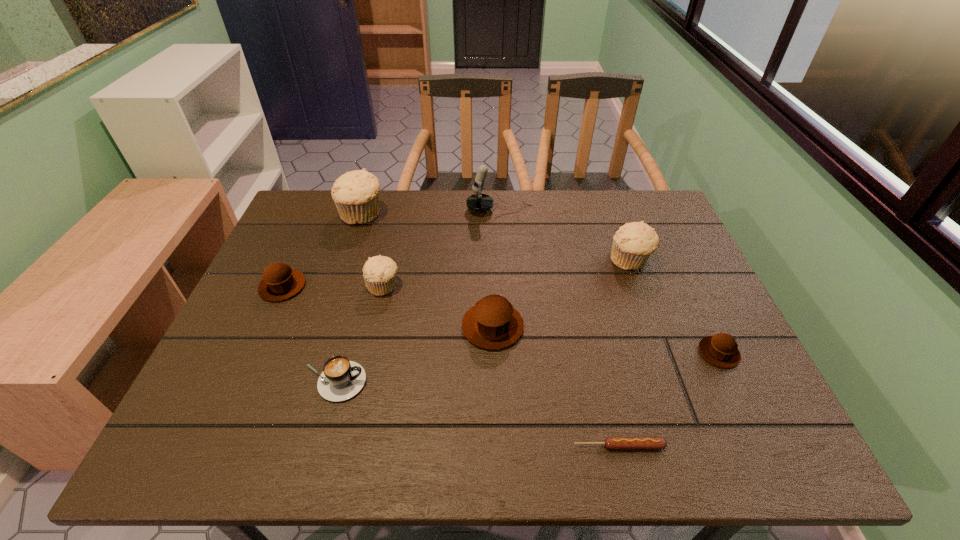
Identify the location of unoccupied area between the leftmost brown muffin and the microphone. The height and width of the screenshot is (540, 960). (391, 248).

At what (x,y) coordinates should I click in order to perform the action: click on vacant area that lies between the fifth tallest muffin and the cappuccino. Please return your answer as a coordinate pair (x, y). The height and width of the screenshot is (540, 960). Looking at the image, I should click on (308, 334).

You are a GUI agent. You are given a task and a screenshot of the screen. Output one action in this format:
    pyautogui.click(x=<x>, y=<y>)
    Task: Click on the free area in between the brown sausage and the seventh shortest object
    
    Given the screenshot: What is the action you would take?
    pyautogui.click(x=624, y=353)

Locate an element on the screen. The image size is (960, 540). empty location between the seventh object from left to right and the second beige muffin from right to left is located at coordinates (501, 366).

Locate which object ranks third in proximity to the microphone. Please provide its 2D coordinates. Your answer should be formatted as a tuple, i.e. [(x, y)], where the tuple contains the x and y coordinates of a point satisfying the conditions above.

[(379, 272)]

Find the location of `object that is the fourth closest to the farthest beige muffin`. object that is the fourth closest to the farthest beige muffin is located at coordinates (493, 323).

This screenshot has width=960, height=540. Find the location of `muffin that is the fourth closest to the brown sausage`. muffin that is the fourth closest to the brown sausage is located at coordinates (379, 272).

What are the coordinates of `the fifth closest muffin to the black cappuccino` in the screenshot? It's located at (633, 243).

Identify which beige muffin is the nearest to the fifth muffin from left to right. Please provide its 2D coordinates. Your answer should be formatted as a tuple, i.e. [(x, y)], where the tuple contains the x and y coordinates of a point satisfying the conditions above.

[(379, 272)]

The height and width of the screenshot is (540, 960). I want to click on the third closest beige muffin relative to the black cappuccino, so [x=633, y=243].